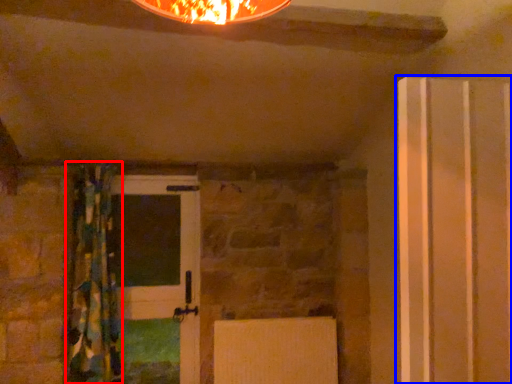
Question: Among these objects, which one is farthest to the camera, curtain (highlighted by a red box) or door (highlighted by a blue box)?

Choices:
 (A) curtain
 (B) door

Answer: (A)